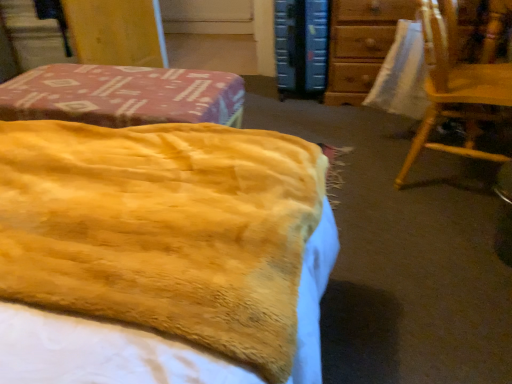
Question: Can you confirm if blue hardcover book at upper center is thinner than yellow plush blanket at center?

Choices:
 (A) yes
 (B) no

Answer: (A)

Question: Considering the relative sizes of blue hardcover book at upper center and yellow plush blanket at center in the image provided, is blue hardcover book at upper center shorter than yellow plush blanket at center?

Choices:
 (A) yes
 (B) no

Answer: (B)

Question: From the image's perspective, is blue hardcover book at upper center beneath yellow plush blanket at center?

Choices:
 (A) yes
 (B) no

Answer: (B)

Question: Is blue hardcover book at upper center wider than yellow plush blanket at center?

Choices:
 (A) no
 (B) yes

Answer: (A)

Question: From a real-world perspective, is blue hardcover book at upper center over yellow plush blanket at center?

Choices:
 (A) yes
 (B) no

Answer: (B)

Question: From their relative heights in the image, would you say blue hardcover book at upper center is taller or shorter than wooden chair at right?

Choices:
 (A) short
 (B) tall

Answer: (A)

Question: Is blue hardcover book at upper center situated inside wooden chair at right or outside?

Choices:
 (A) outside
 (B) inside

Answer: (A)

Question: Considering the positions of blue hardcover book at upper center and wooden chair at right in the image, is blue hardcover book at upper center wider or thinner than wooden chair at right?

Choices:
 (A) wide
 (B) thin

Answer: (B)

Question: From a real-world perspective, is blue hardcover book at upper center positioned above or below wooden chair at right?

Choices:
 (A) below
 (B) above

Answer: (A)

Question: From the image's perspective, is wooden chair at right positioned above or below blue hardcover book at upper center?

Choices:
 (A) below
 (B) above

Answer: (A)

Question: In terms of width, does wooden chair at right look wider or thinner when compared to blue hardcover book at upper center?

Choices:
 (A) thin
 (B) wide

Answer: (B)

Question: Considering the positions of wooden chair at right and blue hardcover book at upper center in the image, is wooden chair at right taller or shorter than blue hardcover book at upper center?

Choices:
 (A) tall
 (B) short

Answer: (A)

Question: Based on their sizes in the image, would you say wooden chair at right is bigger or smaller than blue hardcover book at upper center?

Choices:
 (A) big
 (B) small

Answer: (A)

Question: Does point (410, 155) appear closer or farther from the camera than point (328, 99)?

Choices:
 (A) farther
 (B) closer

Answer: (B)

Question: Is wooden chair at right bigger or smaller than wooden chair at upper right?

Choices:
 (A) small
 (B) big

Answer: (A)